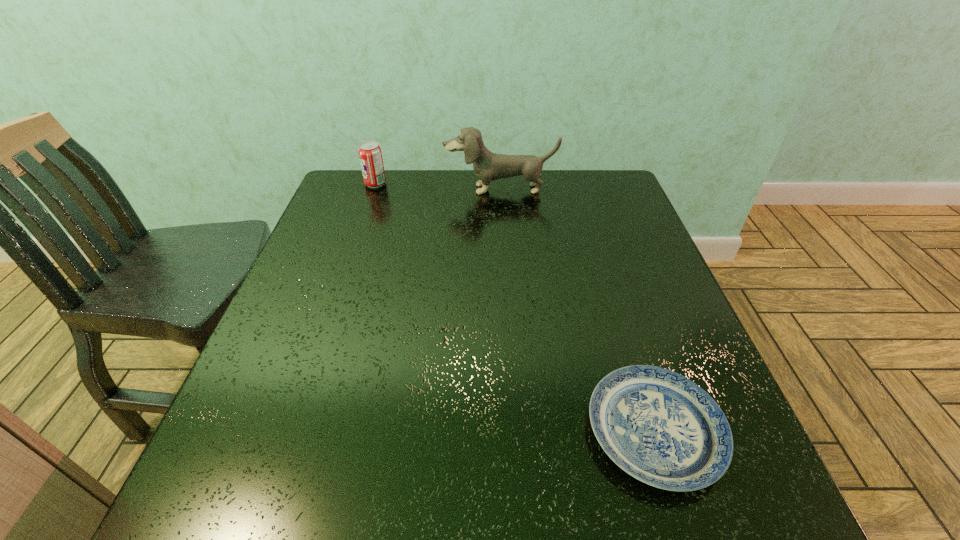
Where is `the tallest object`? Image resolution: width=960 pixels, height=540 pixels. the tallest object is located at coordinates (488, 166).

At what (x,y) coordinates should I click in order to perform the action: click on soda can. Please return your answer as a coordinate pair (x, y). The width and height of the screenshot is (960, 540). Looking at the image, I should click on (370, 155).

I want to click on the leftmost object, so click(370, 155).

Identify the location of plate. This screenshot has width=960, height=540. (660, 427).

The image size is (960, 540). Identify the location of the nearest object. (660, 427).

Locate an element on the screen. The height and width of the screenshot is (540, 960). vacant space located 0.160m at the face of the tallest object is located at coordinates (503, 229).

Find the location of a particular element. The image size is (960, 540). vacant space positioned on the front of the soda can is located at coordinates (351, 255).

You are a GUI agent. You are given a task and a screenshot of the screen. Output one action in this format:
    pyautogui.click(x=<x>, y=<y>)
    Task: Click on the free region located 0.230m on the back of the plate
    
    Given the screenshot: What is the action you would take?
    pyautogui.click(x=610, y=291)

This screenshot has height=540, width=960. I want to click on puppy that is at the far edge, so click(x=488, y=166).

Identify the location of soda can at the far edge. (370, 155).